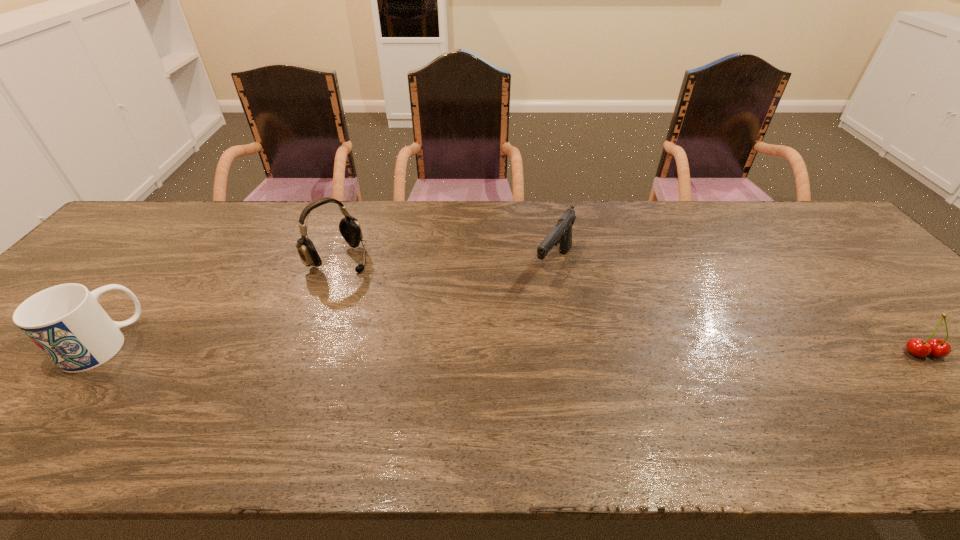
In order to click on the leftmost object in this screenshot , I will do [x=66, y=322].

Locate an element on the screen. cherry is located at coordinates (939, 348).

Identify the location of the shortest object. (939, 348).

Where is `the third object from right to left`? the third object from right to left is located at coordinates (350, 229).

Locate an element on the screen. the tallest object is located at coordinates (350, 229).

Where is `the second object from right to left`? The height and width of the screenshot is (540, 960). the second object from right to left is located at coordinates (561, 234).

At what (x,y) coordinates should I click in order to perform the action: click on vacant space situated on the right of the mug. Please return your answer as a coordinate pair (x, y). The image size is (960, 540). Looking at the image, I should click on (160, 344).

This screenshot has height=540, width=960. Find the location of `vacant space located with the microphone on the side of the headset`. vacant space located with the microphone on the side of the headset is located at coordinates (368, 282).

In order to click on free space located 0.320m with the microphone on the side of the headset in this screenshot , I will do `click(429, 334)`.

Image resolution: width=960 pixels, height=540 pixels. I want to click on blank area located 0.330m with the microphone on the side of the headset, so click(432, 336).